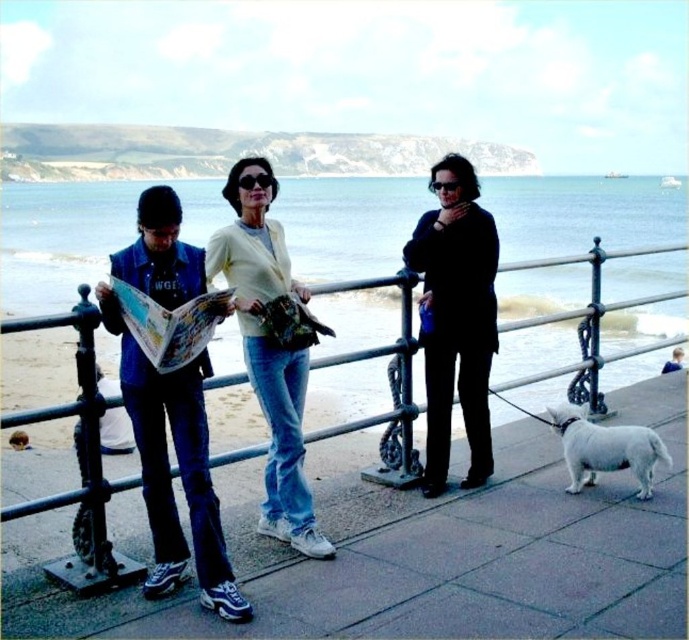
Question: Is denim jacket at left behind light yellow fabric jacket at center?

Choices:
 (A) no
 (B) yes

Answer: (A)

Question: Considering the relative positions of black metal fence at center and black matte jacket at center in the image provided, where is black metal fence at center located with respect to black matte jacket at center?

Choices:
 (A) below
 (B) above

Answer: (A)

Question: Can you confirm if black matte jacket at center is positioned to the right of white fur dog at lower right?

Choices:
 (A) yes
 (B) no

Answer: (B)

Question: Which point is closer to the camera?

Choices:
 (A) coord(103,580)
 (B) coord(174,513)
 (C) coord(577,492)
 (D) coord(475,250)

Answer: (A)

Question: Which point appears closest to the camera in this image?

Choices:
 (A) (477, 412)
 (B) (269, 460)
 (C) (92, 316)

Answer: (C)

Question: Based on their relative distances, which object is farther from the light yellow fabric jacket at center?

Choices:
 (A) black metal fence at center
 (B) black matte jacket at center
 (C) denim jacket at left
 (D) white fur dog at lower right

Answer: (A)